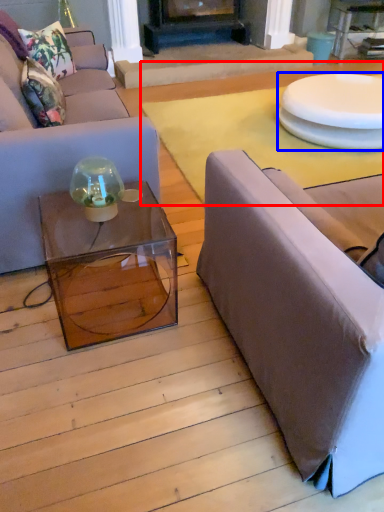
Question: Which of the following is the closest to the observer, plain (highlighted by a red box) or round table (highlighted by a blue box)?

Choices:
 (A) plain
 (B) round table

Answer: (A)